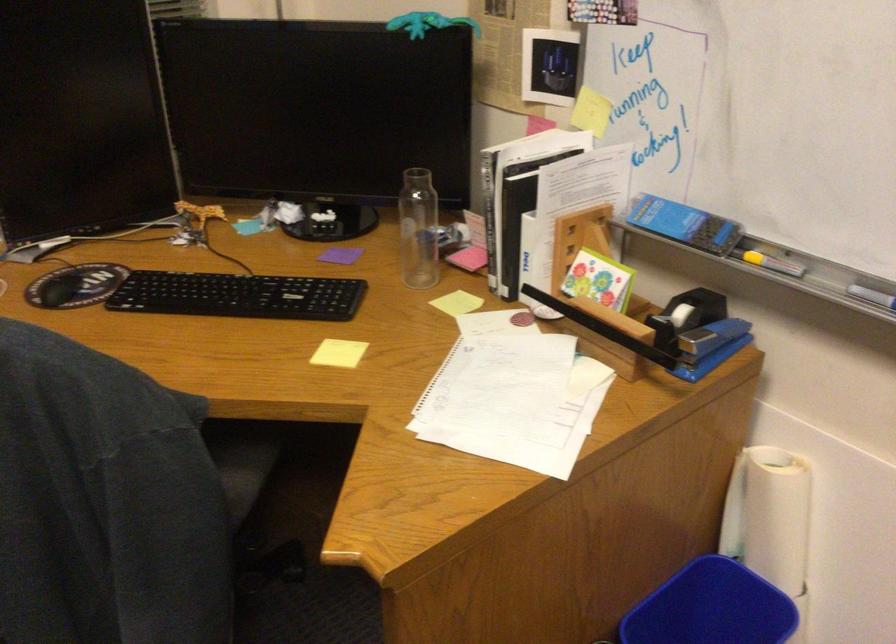
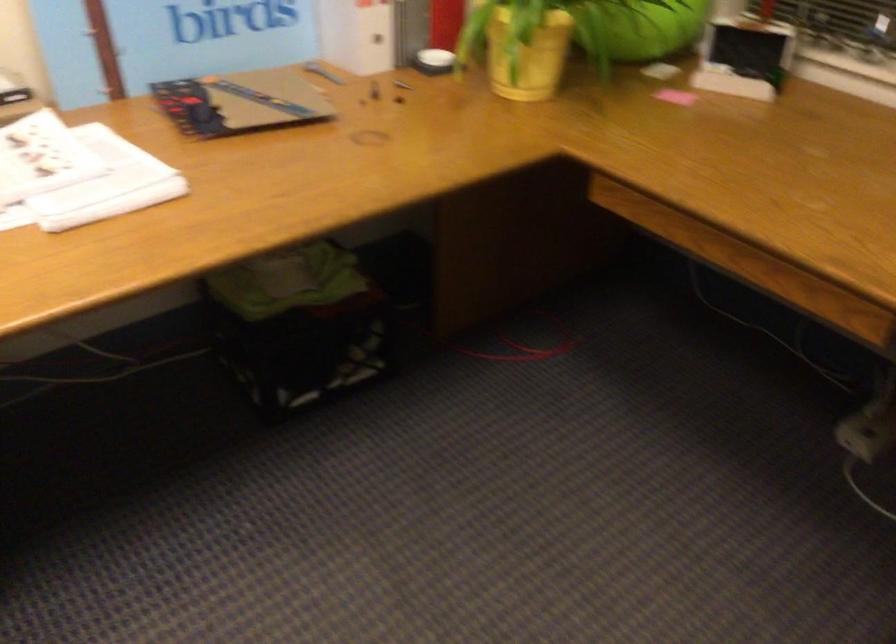
Based on the continuous images, in which direction is the camera rotating?

The camera's rotation is toward left-down.